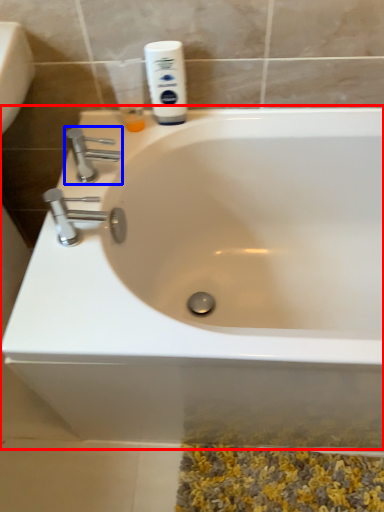
Question: Which point is further to the camera, bathtub (highlighted by a red box) or tap (highlighted by a blue box)?

Choices:
 (A) bathtub
 (B) tap

Answer: (B)